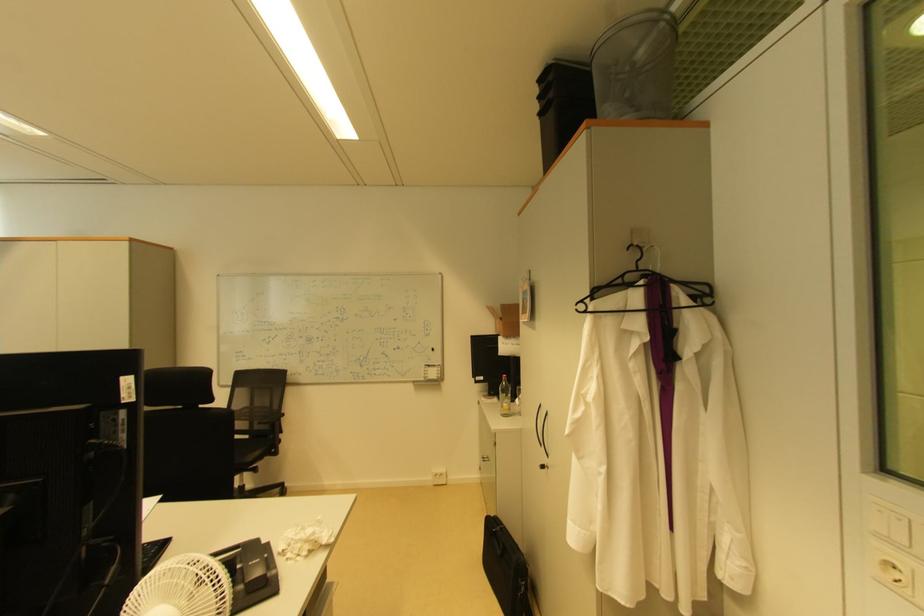
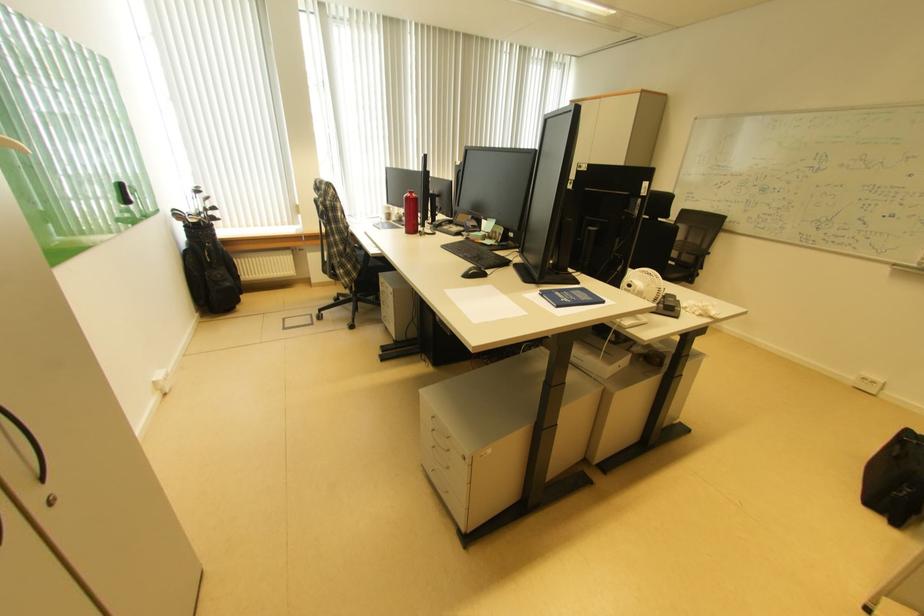
Locate, in the second image, the point that corresponds to the point at 269,424 in the first image.

(697, 254)